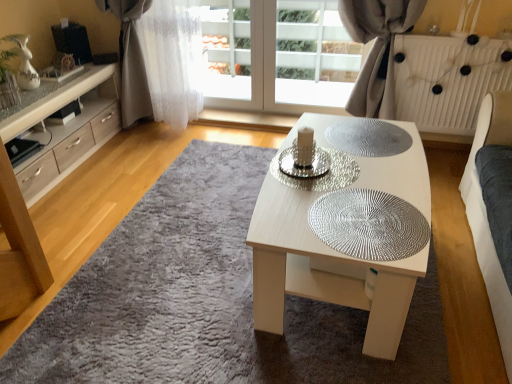
Question: Is white sheer curtain at upper left, which is the 2th curtain from right to left, positioned with its back to silver textured glass plate at center, the 2th glass plate in the front-to-back sequence?

Choices:
 (A) no
 (B) yes

Answer: (A)

Question: Does white sheer curtain at upper left, which is the 2th curtain from right to left, have a smaller size compared to silver textured glass plate at center, the second glass plate when ordered from back to front?

Choices:
 (A) no
 (B) yes

Answer: (A)

Question: Is white sheer curtain at upper left, the 1th curtain in the left-to-right sequence, far away from silver textured glass plate at center, the second glass plate when ordered from back to front?

Choices:
 (A) no
 (B) yes

Answer: (B)

Question: From a real-world perspective, is white sheer curtain at upper left, the 1th curtain in the left-to-right sequence, on top of silver textured glass plate at center, the 2th glass plate in the front-to-back sequence?

Choices:
 (A) yes
 (B) no

Answer: (A)

Question: Would you say silver textured glass plate at center, the second glass plate when ordered from back to front, is part of white sheer curtain at upper left, the 1th curtain in the left-to-right sequence,'s contents?

Choices:
 (A) yes
 (B) no

Answer: (B)

Question: Considering the positions of point (414, 117) and point (350, 160), is point (414, 117) closer or farther from the camera than point (350, 160)?

Choices:
 (A) farther
 (B) closer

Answer: (A)

Question: Based on their sizes in the image, would you say white textured radiator at upper right is bigger or smaller than silver textured glass plate at center, the 2th glass plate in the front-to-back sequence?

Choices:
 (A) small
 (B) big

Answer: (B)

Question: From the image's perspective, is white textured radiator at upper right positioned above or below silver textured glass plate at center, the second glass plate when ordered from back to front?

Choices:
 (A) below
 (B) above

Answer: (B)

Question: Considering the positions of white textured radiator at upper right and silver textured glass plate at center, the 2th glass plate in the front-to-back sequence, in the image, is white textured radiator at upper right wider or thinner than silver textured glass plate at center, the 2th glass plate in the front-to-back sequence,?

Choices:
 (A) wide
 (B) thin

Answer: (B)

Question: Would you say white sheer curtain at upper left, the 1th curtain in the left-to-right sequence, is to the left or to the right of white textured radiator at upper right in the picture?

Choices:
 (A) right
 (B) left

Answer: (B)

Question: Is white sheer curtain at upper left, which is the 2th curtain from right to left, inside the boundaries of white textured radiator at upper right, or outside?

Choices:
 (A) inside
 (B) outside

Answer: (B)

Question: Considering the positions of point (162, 41) and point (470, 49), is point (162, 41) closer or farther from the camera than point (470, 49)?

Choices:
 (A) closer
 (B) farther

Answer: (B)

Question: From a real-world perspective, relative to white textured radiator at upper right, is white sheer curtain at upper left, which is the 2th curtain from right to left, vertically above or below?

Choices:
 (A) below
 (B) above

Answer: (B)

Question: From a real-world perspective, is light wood cabinet at left physically located above or below silver textured mat at center?

Choices:
 (A) below
 (B) above

Answer: (B)

Question: Based on their sizes in the image, would you say light wood cabinet at left is bigger or smaller than silver textured mat at center?

Choices:
 (A) big
 (B) small

Answer: (A)